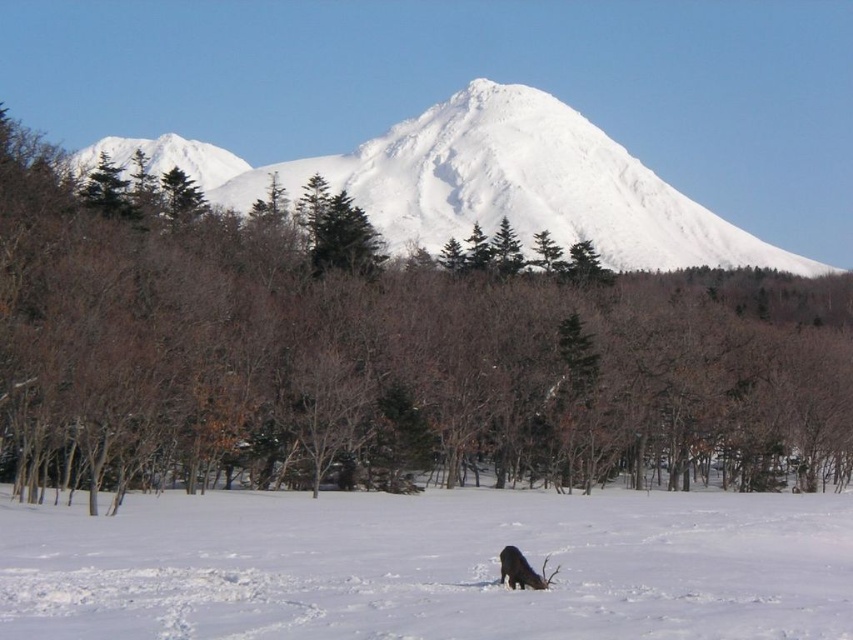
Is white fluffy snow at center bigger than white snow-covered mountain at upper center?

No.

Where is `white fluffy snow at center`? This screenshot has width=853, height=640. white fluffy snow at center is located at coordinates (428, 566).

Can you confirm if white snow-covered mountain at upper left is positioned below black fur at lower center?

Incorrect, white snow-covered mountain at upper left is not positioned below black fur at lower center.

How much distance is there between white snow-covered mountain at upper left and black fur at lower center?

A distance of 222.91 meters exists between white snow-covered mountain at upper left and black fur at lower center.

At what (x,y) coordinates should I click in order to perform the action: click on white snow-covered mountain at upper left. Please return your answer as a coordinate pair (x, y). The image size is (853, 640). Looking at the image, I should click on (164, 157).

How far apart are white snow-covered mountain at upper center and white snow-covered mountain at upper left?

white snow-covered mountain at upper center and white snow-covered mountain at upper left are 28.10 meters apart.

Which is in front, point (485, 196) or point (193, 154)?

Point (485, 196) is more forward.

Find the location of a particular element. The width and height of the screenshot is (853, 640). white snow-covered mountain at upper center is located at coordinates (x=488, y=182).